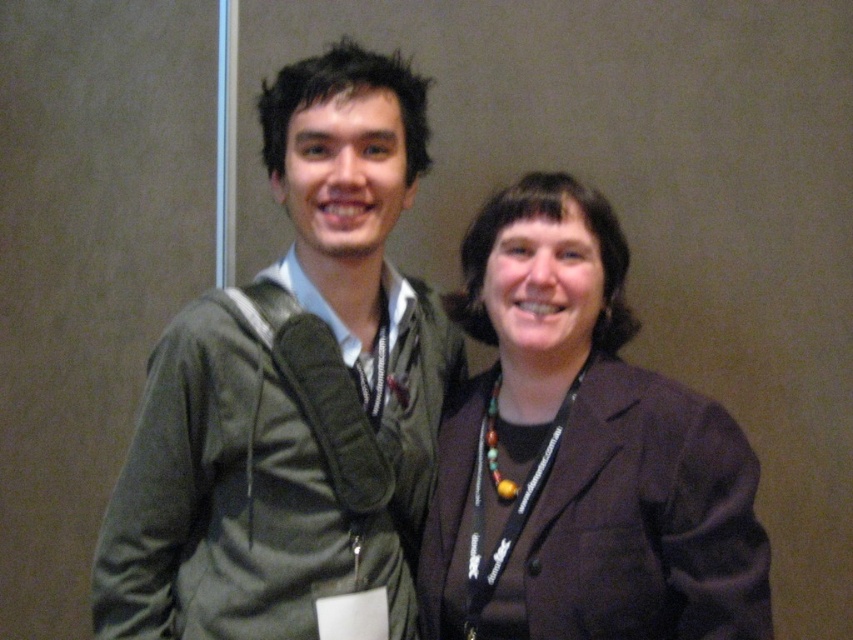
Question: Which point is closer to the camera?

Choices:
 (A) green fabric jacket at left
 (B) brown fabric jacket at center

Answer: (B)

Question: Where is green fabric jacket at left located in relation to brown fabric jacket at center in the image?

Choices:
 (A) below
 (B) above

Answer: (B)

Question: In this image, where is green fabric jacket at left located relative to brown fabric jacket at center?

Choices:
 (A) left
 (B) right

Answer: (A)

Question: Which point is farther to the camera?

Choices:
 (A) (370, 586)
 (B) (703, 579)

Answer: (A)

Question: Which point is closer to the camera?

Choices:
 (A) green fabric jacket at left
 (B) brown fabric jacket at center

Answer: (B)

Question: Does green fabric jacket at left appear on the right side of brown fabric jacket at center?

Choices:
 (A) yes
 (B) no

Answer: (B)